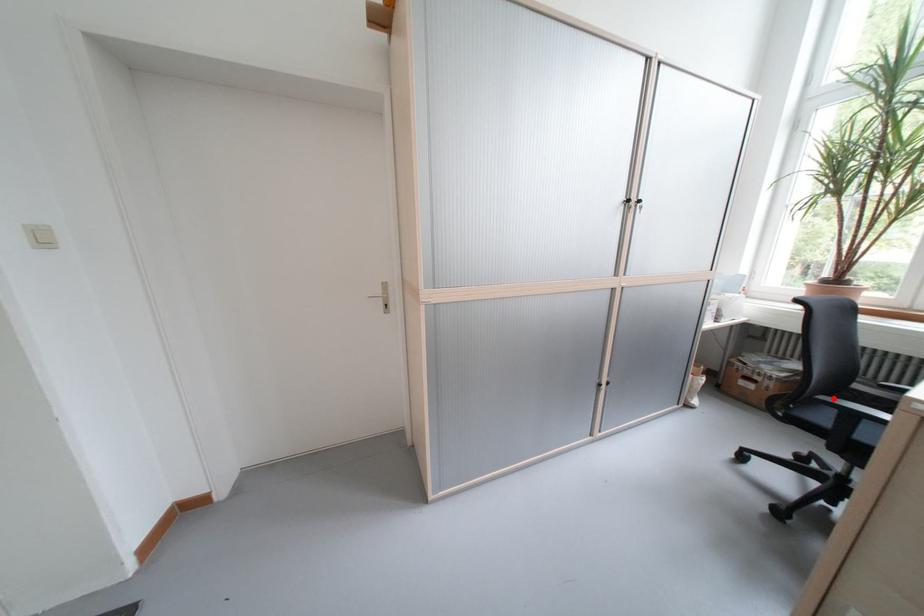
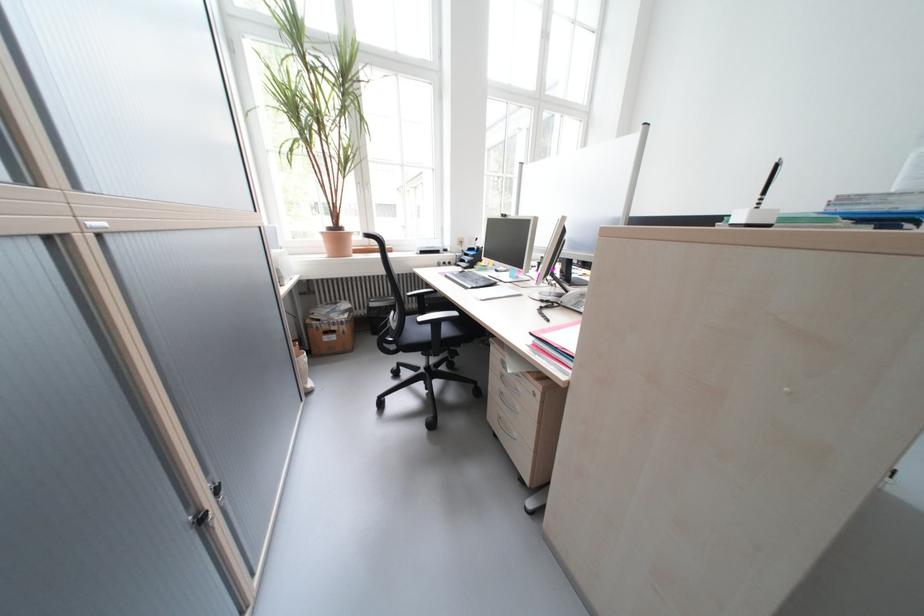
The point at the highlighted location is marked in the first image. Where is the corresponding point in the second image?

(431, 320)